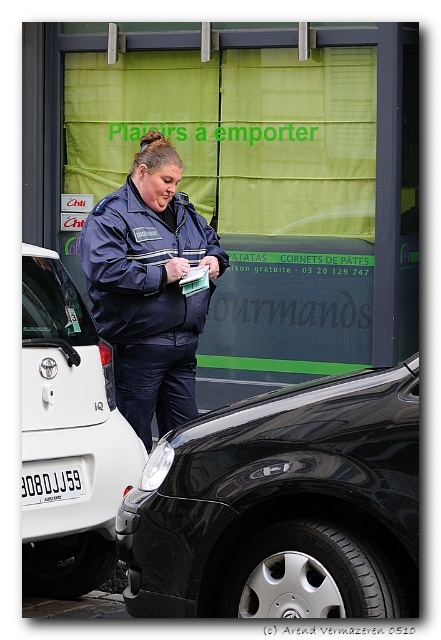
Question: Is shiny black car at lower right above white matte car at left?

Choices:
 (A) no
 (B) yes

Answer: (A)

Question: Estimate the real-world distances between objects in this image. Which object is closer to the matte blue uniform at center?

Choices:
 (A) shiny black car at lower right
 (B) white matte car at left

Answer: (B)

Question: Which of these objects is positioned farthest from the matte blue uniform at center?

Choices:
 (A) shiny black car at lower right
 (B) white matte car at left

Answer: (A)

Question: Which object appears farthest from the camera in this image?

Choices:
 (A) matte blue uniform at center
 (B) white matte car at left
 (C) white plastic license plate at center

Answer: (A)

Question: Observing the image, what is the correct spatial positioning of white matte car at left in reference to white plastic license plate at center?

Choices:
 (A) below
 (B) above

Answer: (B)

Question: Is shiny black car at lower right further to camera compared to white matte car at left?

Choices:
 (A) yes
 (B) no

Answer: (B)